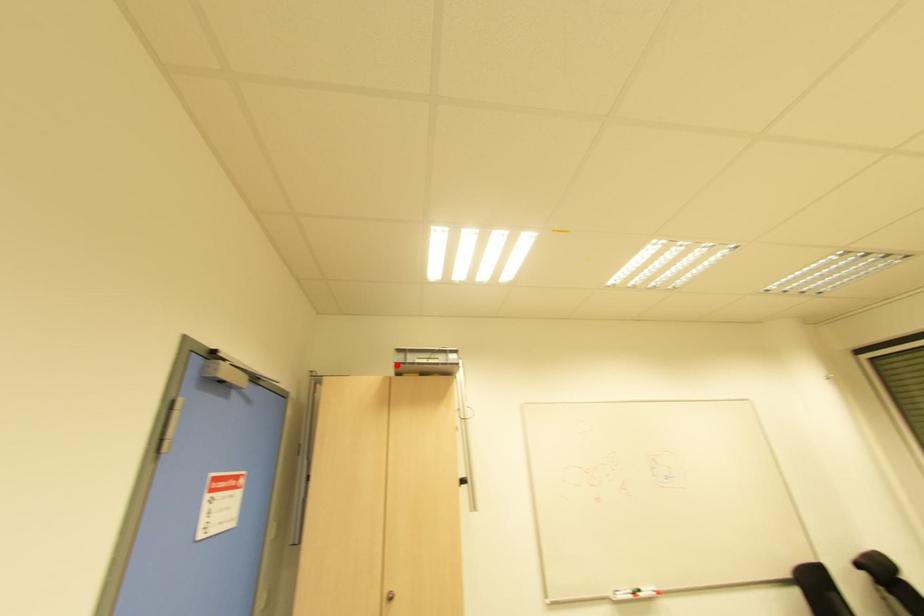
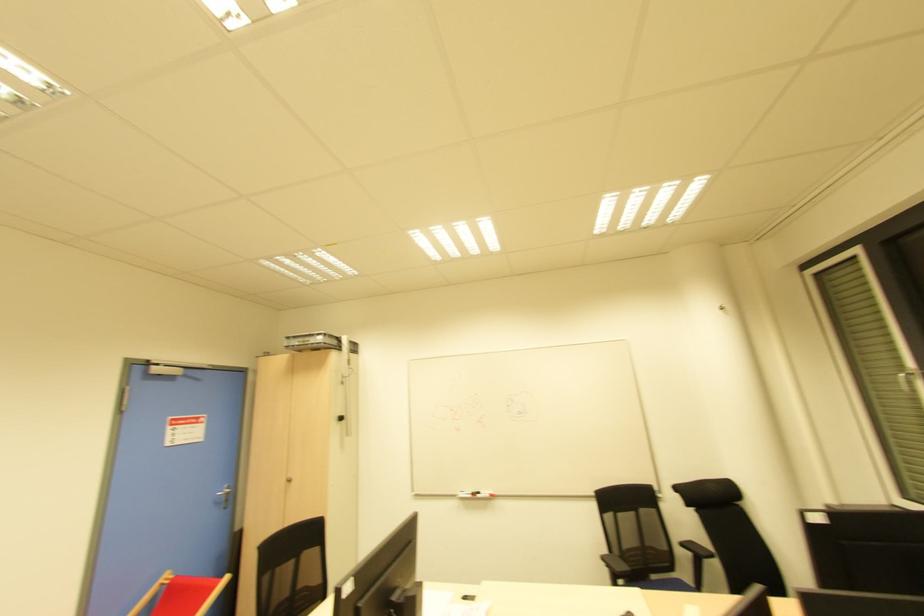
In the second image, find the point that corresponds to the highlighted location in the first image.

(286, 347)